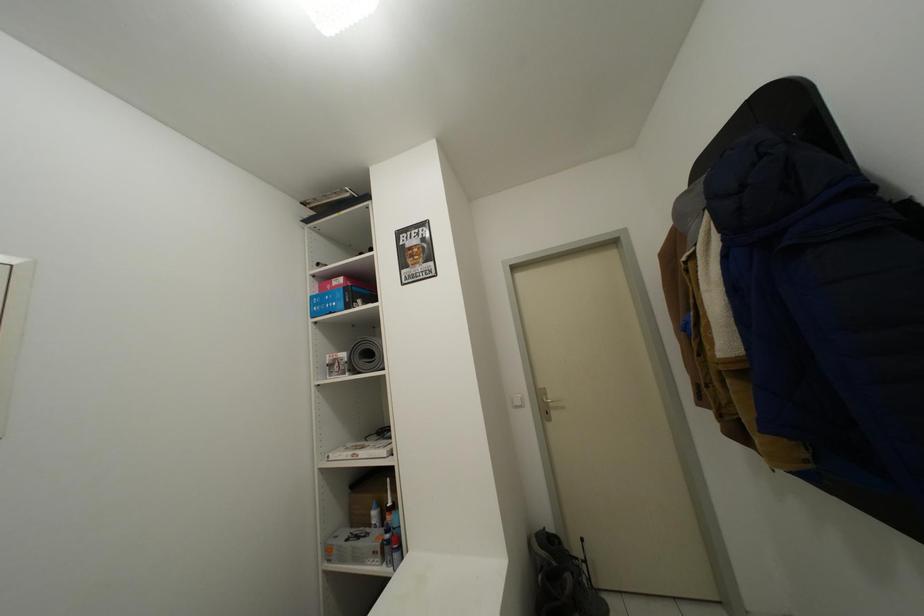
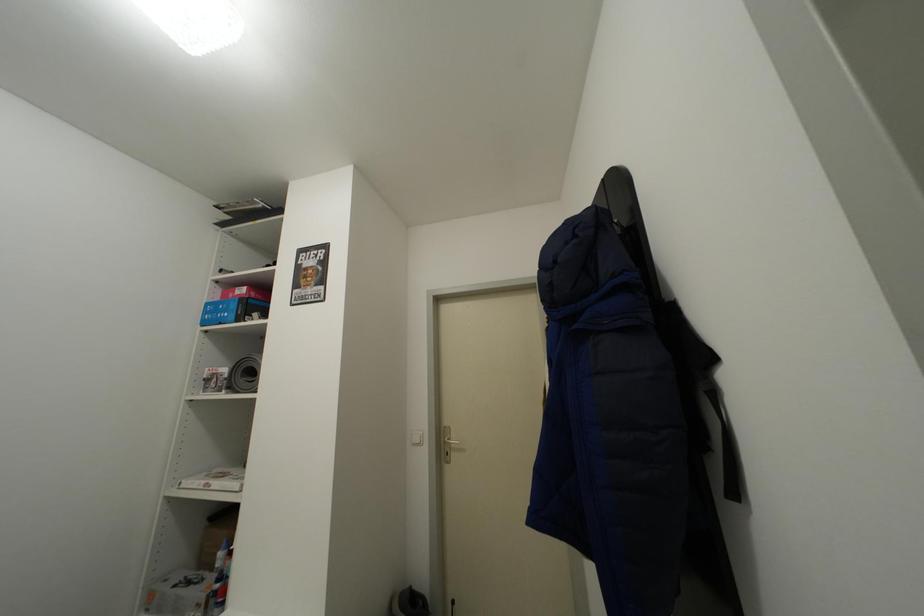
Question: How did the camera likely rotate?

Choices:
 (A) Left
 (B) Right
 (C) Up
 (D) Down

Answer: (C)